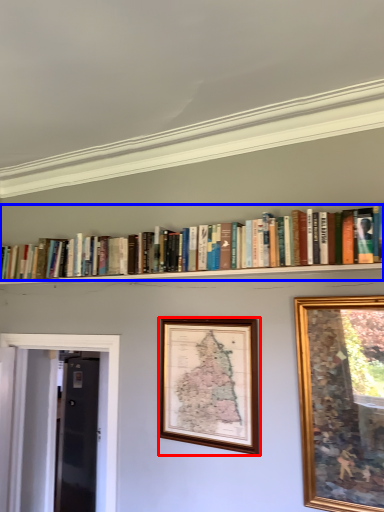
Question: Which point is further to the camera, picture frame (highlighted by a red box) or book (highlighted by a blue box)?

Choices:
 (A) picture frame
 (B) book

Answer: (A)